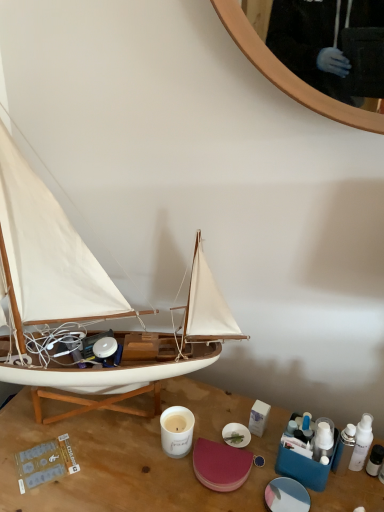
Find the location of a particular element. free space below wooden sailboat at left (from a real-world perspective) is located at coordinates (110, 424).